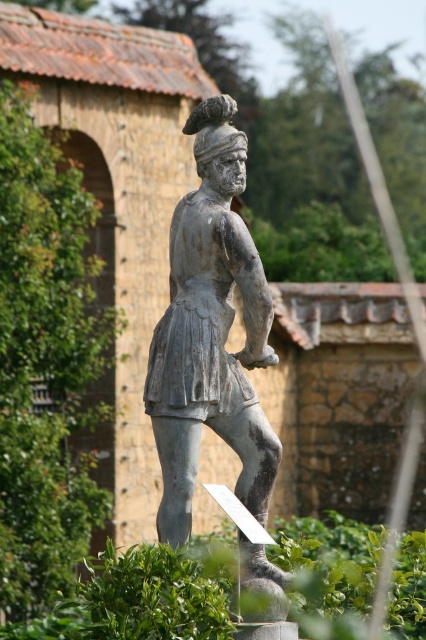
In the scene shown: You are an art conservator examining the scene. You notice two statues labeled as matte gray statue at center and gray stone statue at center. According to the spatial arrangement, which statue is positioned farther from the viewer?

The gray stone statue at center is farther from the viewer because it is positioned behind the matte gray statue at center.

You are an art conservator examining two statues in a garden. You notice the matte gray statue at center and the gray stone statue at center. According to their positions, which statue is located to the right of the other?

The matte gray statue at center is to the right of the gray stone statue at center.